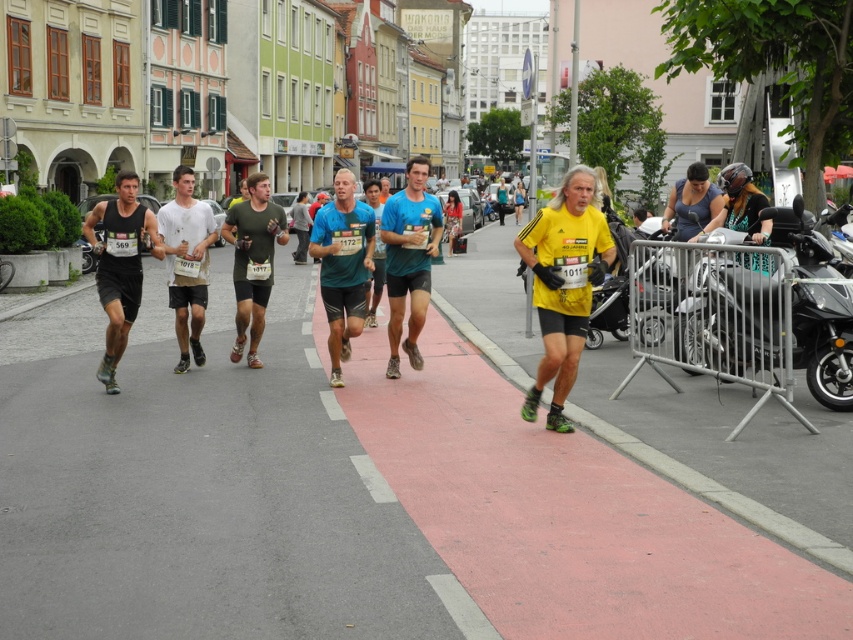
Is point (189, 241) behind point (239, 204)?

No, it is in front of (239, 204).

The image size is (853, 640). What do you see at coordinates (186, 262) in the screenshot?
I see `white matte shorts at center` at bounding box center [186, 262].

Between point (192, 196) and point (236, 339), which one is positioned in front?

Point (236, 339) is more forward.

Where is `white matte shorts at center`? white matte shorts at center is located at coordinates (186, 262).

Does teal matte shirt at center appear over teal matte shorts at center?

Indeed, teal matte shirt at center is positioned over teal matte shorts at center.

Is teal matte shirt at center further to the viewer compared to teal matte shorts at center?

That is False.

I want to click on teal matte shirt at center, so click(x=343, y=266).

Can you confirm if teal matte shirt at center is wider than matte black shorts at left?

Incorrect, teal matte shirt at center's width does not surpass matte black shorts at left's.

Is teal matte shirt at center positioned at the back of matte black shorts at left?

Yes, teal matte shirt at center is behind matte black shorts at left.

Is point (364, 225) more distant than point (136, 273)?

Yes, point (364, 225) is farther from viewer.

This screenshot has height=640, width=853. Find the location of `teal matte shirt at center`. teal matte shirt at center is located at coordinates (x=343, y=266).